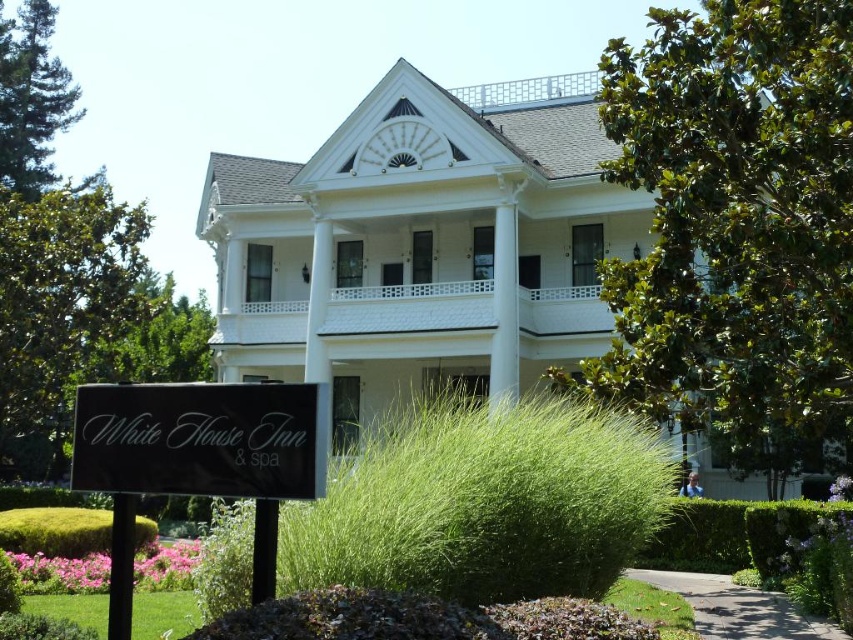
Question: Can you confirm if green grass at lower center is thinner than black matte sign at lower left?

Choices:
 (A) no
 (B) yes

Answer: (A)

Question: Among these objects, which one is farthest from the camera?

Choices:
 (A) black matte sign at lower left
 (B) green grass at lower center
 (C) green mossy hedge at lower left

Answer: (C)

Question: Does green grass at lower center appear over black matte sign at lower left?

Choices:
 (A) no
 (B) yes

Answer: (A)

Question: Is black matte sign at lower left positioned in front of green mossy hedge at lower left?

Choices:
 (A) no
 (B) yes

Answer: (B)

Question: Which of the following is the farthest from the observer?

Choices:
 (A) (409, 410)
 (B) (79, 452)
 (C) (64, 554)

Answer: (A)

Question: Among these points, which one is nearest to the camera?

Choices:
 (A) (347, 497)
 (B) (142, 456)

Answer: (B)